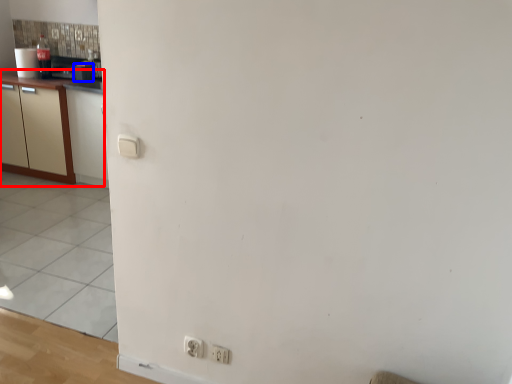
Question: Which object appears farthest to the camera in this image, cabinetry (highlighted by a red box) or appliance (highlighted by a blue box)?

Choices:
 (A) cabinetry
 (B) appliance

Answer: (B)